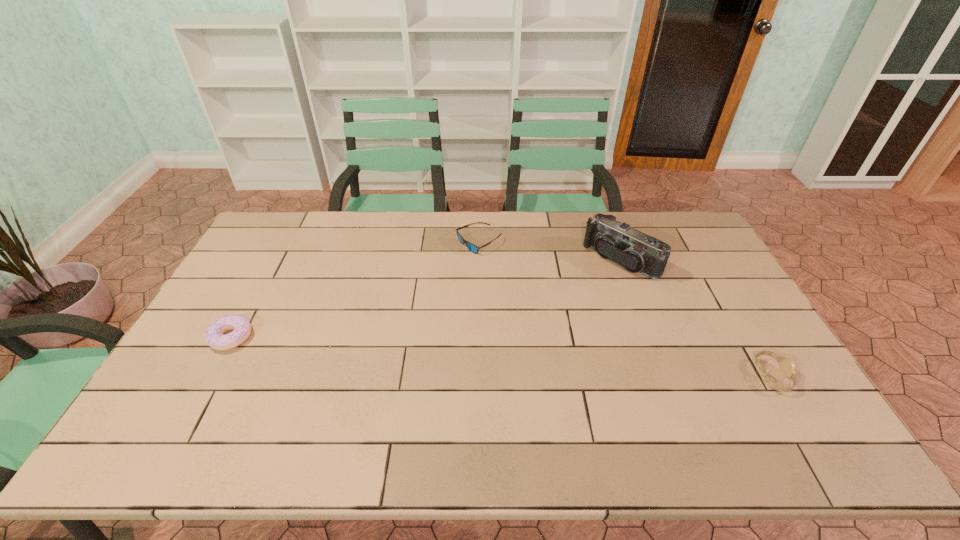
At what (x,y) coordinates should I click in order to perform the action: click on vacant area that lies between the doughnut and the tallest object. Please return your answer as a coordinate pair (x, y). The width and height of the screenshot is (960, 540). Looking at the image, I should click on (426, 299).

Find the location of a particular element. The height and width of the screenshot is (540, 960). unoccupied position between the camcorder and the third farthest object is located at coordinates (426, 299).

The image size is (960, 540). Identify the location of unoccupied position between the doughnut and the tallest object. (426, 299).

You are a GUI agent. You are given a task and a screenshot of the screen. Output one action in this format:
    pyautogui.click(x=<x>, y=<y>)
    Task: Click on the vacant point located between the camcorder and the rightmost object
    
    Given the screenshot: What is the action you would take?
    point(696,318)

Identify the location of vacant space that is in between the sunglasses and the leftmost object. The image size is (960, 540). (355, 290).

Identify which object is the second nearest to the nearest object. Please provide its 2D coordinates. Your answer should be formatted as a tuple, i.e. [(x, y)], where the tuple contains the x and y coordinates of a point satisfying the conditions above.

[(473, 248)]

Point out which object is positioned as the nearest to the doughnut. Please provide its 2D coordinates. Your answer should be formatted as a tuple, i.e. [(x, y)], where the tuple contains the x and y coordinates of a point satisfying the conditions above.

[(473, 248)]

Identify the location of free location that satisfies the following two spatial constraints: 1. on the front side of the rightmost object; 2. on the face of the leftmost object. The width and height of the screenshot is (960, 540). (211, 376).

Locate an element on the screen. vacant point that satisfies the following two spatial constraints: 1. on the back side of the second object from left to right; 2. on the right side of the leftmost object is located at coordinates (283, 243).